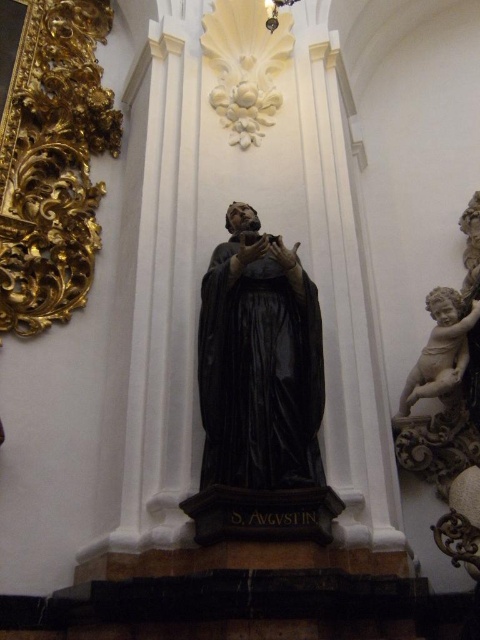
Between black polished statue at center and white marble cherub at right, which one appears on the left side from the viewer's perspective?

From the viewer's perspective, black polished statue at center appears more on the left side.

Can you confirm if black polished statue at center is positioned below white marble cherub at right?

Actually, black polished statue at center is above white marble cherub at right.

Does point (252, 308) lie in front of point (405, 412)?

Yes, point (252, 308) is in front of point (405, 412).

Where is `black polished statue at center`? This screenshot has height=640, width=480. black polished statue at center is located at coordinates (259, 362).